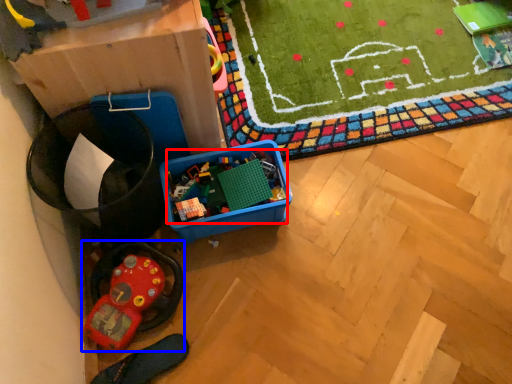
Question: Among these objects, which one is nearest to the camera, toy (highlighted by a red box) or toy (highlighted by a blue box)?

Choices:
 (A) toy
 (B) toy

Answer: (B)